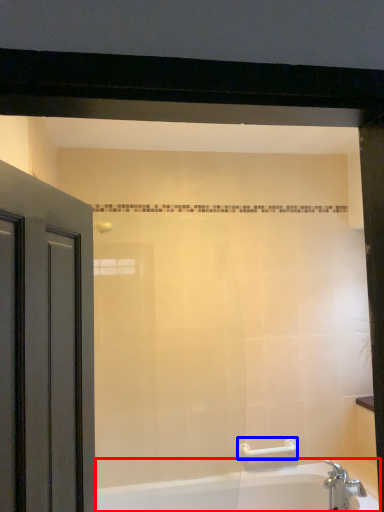
Question: Which object appears farthest to the camera in this image, bathtub (highlighted by a red box) or towel bar (highlighted by a blue box)?

Choices:
 (A) bathtub
 (B) towel bar

Answer: (B)